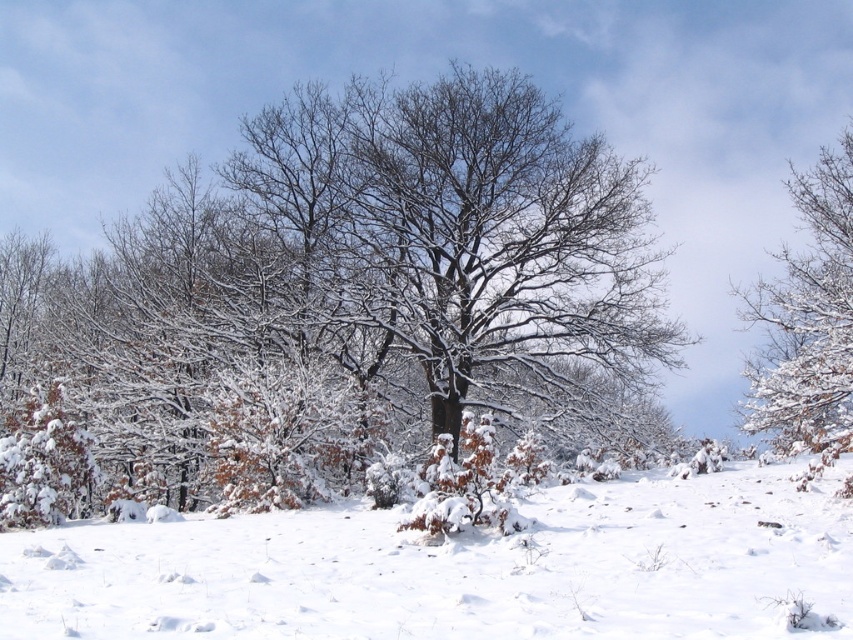
You are standing at the point with coordinates point (840, 312) and want to walk towards the point with coordinates point (463, 628). According to the image, will you be moving towards a point that is in front of or behind your current position?

Point (463, 628) is in front of point (840, 312), so you will be moving towards a point that is in front of your current position.

You are a snowplow operator trying to clear a path through the winter landscape. The white fluffy snow at center is blocking the way. Can you estimate the coordinates of the snow blockage to direct your plow effectively?

The white fluffy snow at center is located at point (457, 568), so you should direct your plow towards those coordinates to clear the blockage.